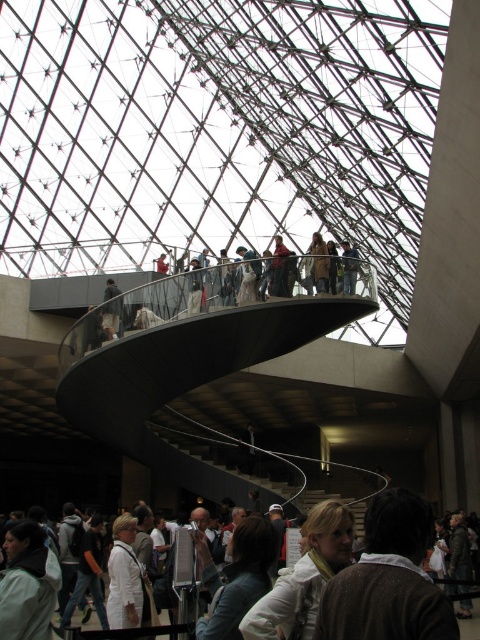
Question: Is the position of white fabric scarf at center more distant than that of light beige fabric jacket at upper center?

Choices:
 (A) no
 (B) yes

Answer: (A)

Question: Can you confirm if white fabric scarf at center is positioned to the left of light beige fabric jacket at upper center?

Choices:
 (A) yes
 (B) no

Answer: (B)

Question: Can you confirm if white fabric scarf at center is smaller than light beige fabric jacket at upper center?

Choices:
 (A) no
 (B) yes

Answer: (A)

Question: Estimate the real-world distances between objects in this image. Which object is closer to the light beige fabric jacket at upper center?

Choices:
 (A) white fabric scarf at center
 (B) light brown hair at lower center

Answer: (A)

Question: Among these points, which one is nearest to the camera?

Choices:
 (A) (359, 500)
 (B) (108, 323)

Answer: (B)

Question: Which point is farther from the camera taking this photo?

Choices:
 (A) (117, 323)
 (B) (274, 508)

Answer: (B)